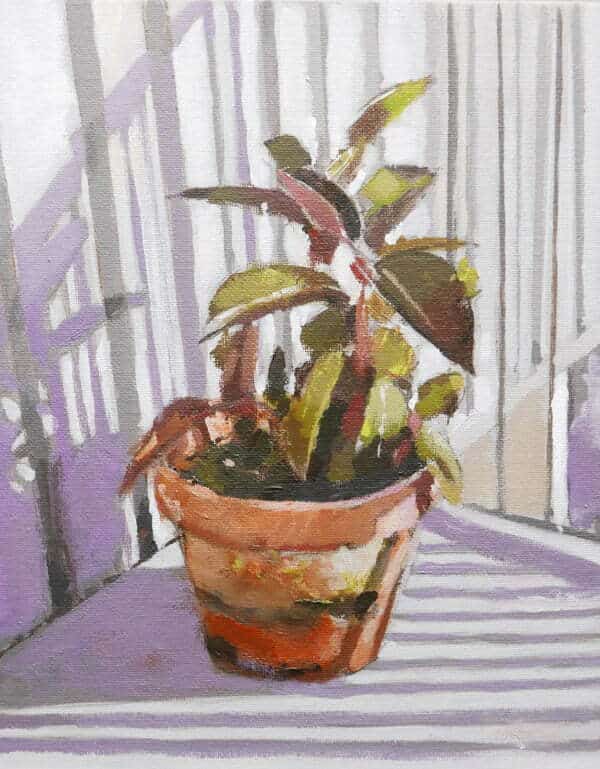
Find the location of `center left side of pot of painted plant`. center left side of pot of painted plant is located at coordinates (188, 577).